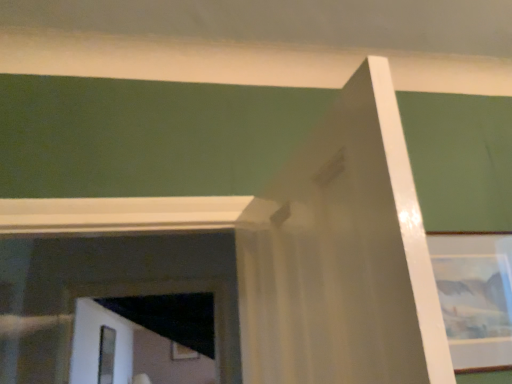
Question: From a real-world perspective, is wooden picture frame at lower center, which is the first picture frame in bottom-to-top order, located higher than clear glass screen door at lower left?

Choices:
 (A) yes
 (B) no

Answer: (A)

Question: Is wooden picture frame at lower center, which is the first picture frame in bottom-to-top order, at the left side of clear glass screen door at lower left?

Choices:
 (A) no
 (B) yes

Answer: (A)

Question: Is wooden picture frame at lower center, the first picture frame positioned from the left, touching clear glass screen door at lower left?

Choices:
 (A) yes
 (B) no

Answer: (B)

Question: From a real-world perspective, is wooden picture frame at lower center, the second picture frame from the front, physically below clear glass screen door at lower left?

Choices:
 (A) yes
 (B) no

Answer: (B)

Question: Is wooden picture frame at lower center, arranged as the 2th picture frame when viewed from the right, closer to the viewer compared to clear glass screen door at lower left?

Choices:
 (A) no
 (B) yes

Answer: (A)

Question: Is wooden picture frame at lower center, the second picture frame from the front, not inside clear glass screen door at lower left?

Choices:
 (A) yes
 (B) no

Answer: (A)

Question: Can you confirm if matte glass picture frame at upper right, the 1th picture frame viewed from the front, is smaller than clear glass screen door at lower left?

Choices:
 (A) yes
 (B) no

Answer: (A)

Question: Is matte glass picture frame at upper right, which appears as the 1th picture frame when viewed from the right, not near clear glass screen door at lower left?

Choices:
 (A) yes
 (B) no

Answer: (A)

Question: Is matte glass picture frame at upper right, which appears as the 1th picture frame when viewed from the right, oriented towards clear glass screen door at lower left?

Choices:
 (A) yes
 (B) no

Answer: (B)

Question: Is matte glass picture frame at upper right, which is counted as the second picture frame, starting from the bottom, thinner than clear glass screen door at lower left?

Choices:
 (A) yes
 (B) no

Answer: (A)

Question: Can you confirm if matte glass picture frame at upper right, which is counted as the second picture frame, starting from the bottom, is bigger than clear glass screen door at lower left?

Choices:
 (A) no
 (B) yes

Answer: (A)

Question: Is matte glass picture frame at upper right, which ranks as the first picture frame in top-to-bottom order, positioned beyond the bounds of clear glass screen door at lower left?

Choices:
 (A) no
 (B) yes

Answer: (B)

Question: Is the position of matte glass picture frame at upper right, the 1th picture frame viewed from the front, less distant than that of wooden picture frame at lower center, which is the first picture frame in bottom-to-top order?

Choices:
 (A) no
 (B) yes

Answer: (B)